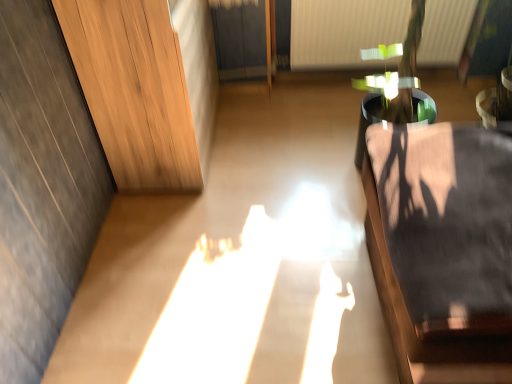
What do you see at coordinates (443, 247) in the screenshot?
I see `matte black table at right` at bounding box center [443, 247].

Where is `matte black table at right`? The height and width of the screenshot is (384, 512). matte black table at right is located at coordinates (443, 247).

I want to click on matte black table at right, so click(443, 247).